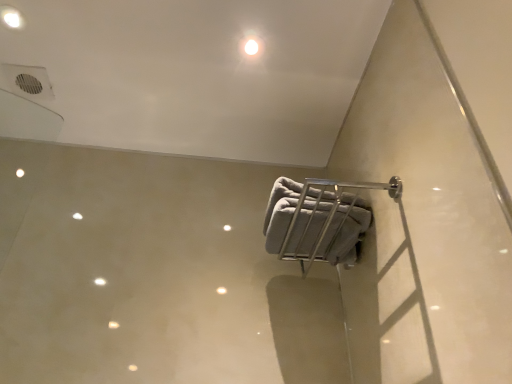
Question: Which is correct: white glossy light at upper center, the 2th dot from the left, is inside white glossy light fixture at upper left, the 2th dot positioned from the bottom, or outside of it?

Choices:
 (A) outside
 (B) inside

Answer: (A)

Question: Looking at the image, does white glossy light at upper center, which appears as the 1th dot when ordered from the bottom, seem bigger or smaller compared to white glossy light fixture at upper left, the 1th dot in the left-to-right sequence?

Choices:
 (A) big
 (B) small

Answer: (A)

Question: Which is farther from the gray fabric towel at center-right?

Choices:
 (A) white glossy light fixture at upper left, the 1th dot in the left-to-right sequence
 (B) white glossy light at upper center, which appears as the first dot when viewed from the right

Answer: (A)

Question: Which is farther from the white glossy light at upper center, which appears as the first dot when viewed from the right?

Choices:
 (A) gray fabric towel at center-right
 (B) white glossy light fixture at upper left, the second dot in the right-to-left sequence

Answer: (B)